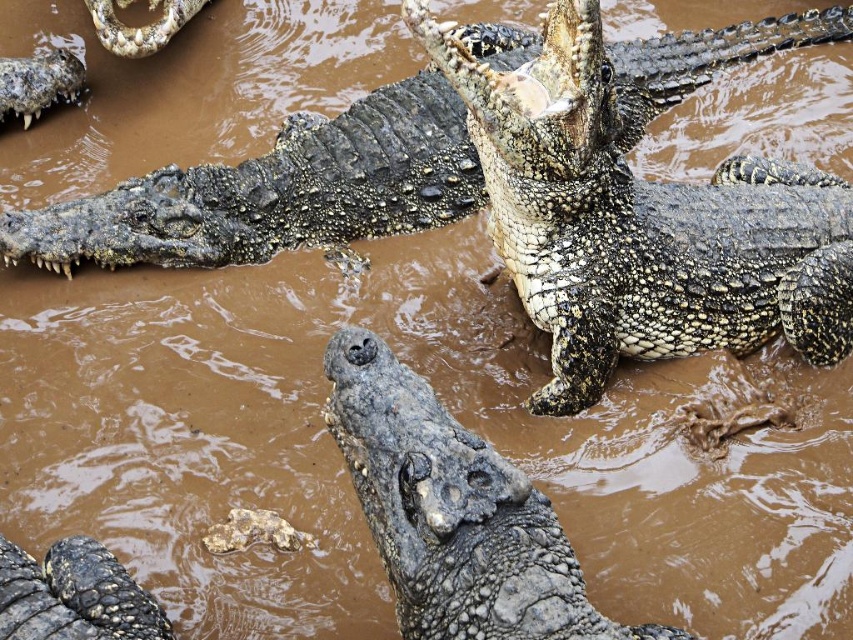
Consider the image. You are a wildlife photographer aiming to capture the crocodiles in the scene. You want to focus on the rough scaly crocodile at upper right and the rough textured crocodile at center. Which crocodile would appear larger in your photo if you keep the camera distance the same?

The rough scaly crocodile at upper right would appear larger in the photo since it is much taller than the rough textured crocodile at center.

You are standing near the edge of the muddy water and see the rough scaly crocodile at upper right. If you want to safely observe it without getting too close, what is the minimum distance you should maintain?

The rough scaly crocodile at upper right is 7.50 feet away from the viewer. To safely observe it without getting too close, you should maintain a distance of at least 7.50 feet or more.

In the scene shown: You are a wildlife photographer trying to capture a closeup of the rough scaly crocodile at upper right and the dark gray scaly head at lower left. Which crocodile should you focus on first if you want to take a photo of the larger one?

The rough scaly crocodile at upper right is larger in size than the dark gray scaly head at lower left, so you should focus on the rough scaly crocodile at upper right first.